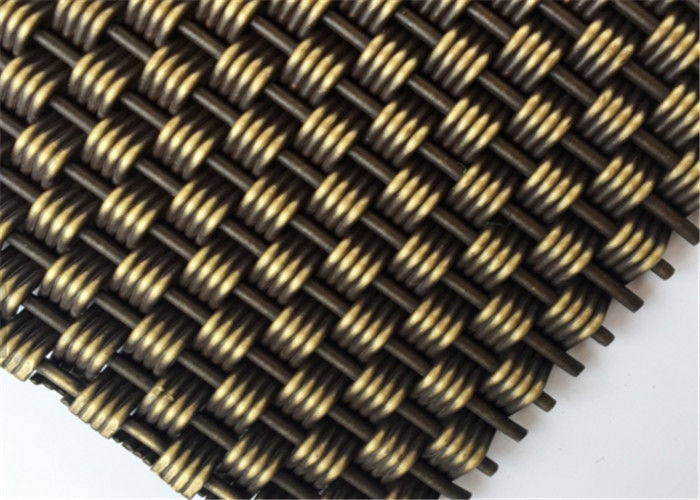
Locate an element on the screen. The width and height of the screenshot is (700, 500). rod is located at coordinates (514, 427), (624, 294), (572, 368), (670, 218), (279, 438).